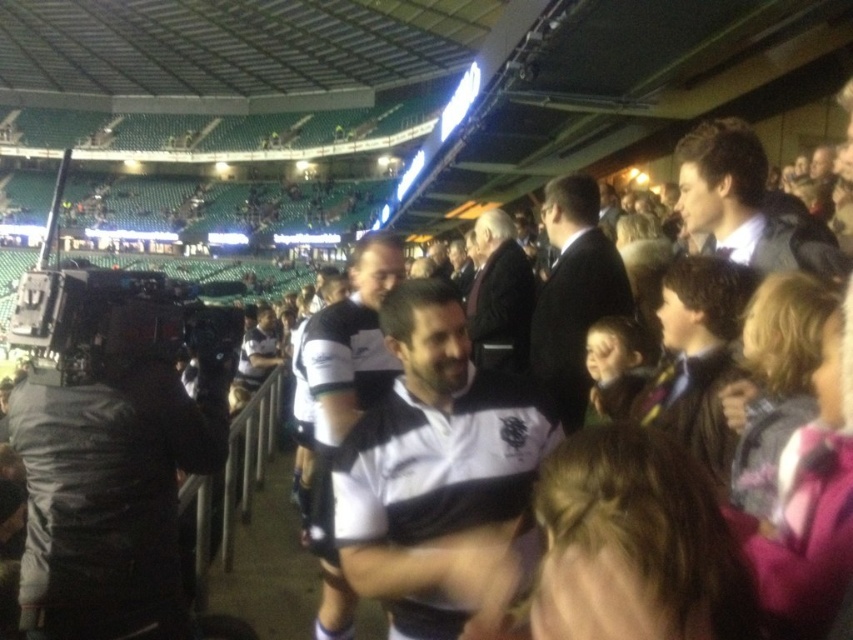
Between point (700, 404) and point (577, 336), which one is positioned in front?

Point (700, 404)

Is point (676, 333) behind point (573, 285)?

That is False.

Between point (741, 292) and point (561, 362), which one is positioned in front?

Point (741, 292) is in front.

Where is `brown hair at right`? This screenshot has width=853, height=640. brown hair at right is located at coordinates (698, 356).

Can you confirm if white jersey at center is positioned below dark brown suit at center?

Yes, white jersey at center is below dark brown suit at center.

Is point (392, 266) farther from viewer compared to point (515, 296)?

No.

This screenshot has width=853, height=640. Find the location of `white jersey at center`. white jersey at center is located at coordinates (344, 401).

Does white jersey at center have a smaller size compared to dark blue shirt at upper right?

Indeed, white jersey at center has a smaller size compared to dark blue shirt at upper right.

Is point (323, 612) closer to viewer compared to point (822, 260)?

No, it is not.

Identify the location of white jersey at center. The width and height of the screenshot is (853, 640). (344, 401).